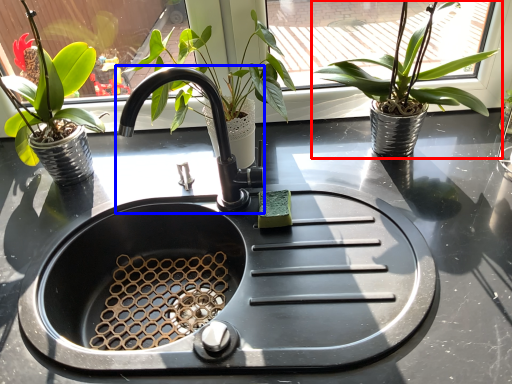
Question: Which object appears farthest to the camera in this image, houseplant (highlighted by a red box) or tap (highlighted by a blue box)?

Choices:
 (A) houseplant
 (B) tap

Answer: (A)